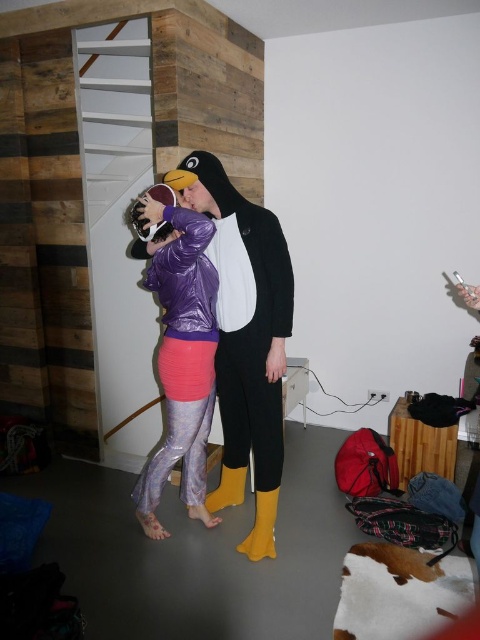
Question: Which point is closer to the camera?

Choices:
 (A) yellow rubber boot at center
 (B) yellow rubber boot at lower center

Answer: (B)

Question: Where is matte purple jacket at center located in relation to yellow rubber boot at center in the image?

Choices:
 (A) right
 (B) left

Answer: (A)

Question: Which point appears closest to the camera in this image?

Choices:
 (A) (233, 490)
 (B) (257, 520)

Answer: (B)

Question: Does matte purple jacket at center lie behind shiny purple jacket at center?

Choices:
 (A) yes
 (B) no

Answer: (A)

Question: Which point is closer to the camera?

Choices:
 (A) shiny purple jacket at center
 (B) yellow rubber boot at lower center
 (C) yellow rubber boot at center
 (D) matte purple jacket at center

Answer: (A)

Question: Does matte purple jacket at center appear on the right side of yellow rubber boot at center?

Choices:
 (A) yes
 (B) no

Answer: (A)